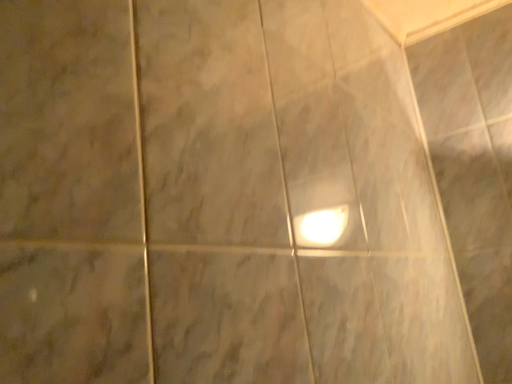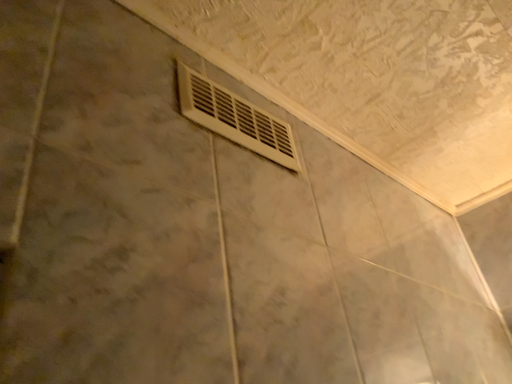
Question: How did the camera likely rotate when shooting the video?

Choices:
 (A) rotated upward
 (B) rotated downward

Answer: (A)